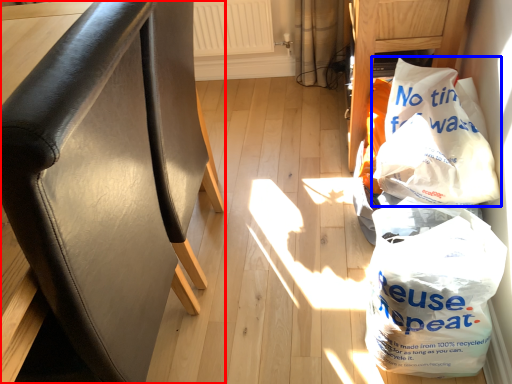
Question: Which object is further to the camera taking this photo, furniture (highlighted by a red box) or plastic bag (highlighted by a blue box)?

Choices:
 (A) furniture
 (B) plastic bag

Answer: (B)